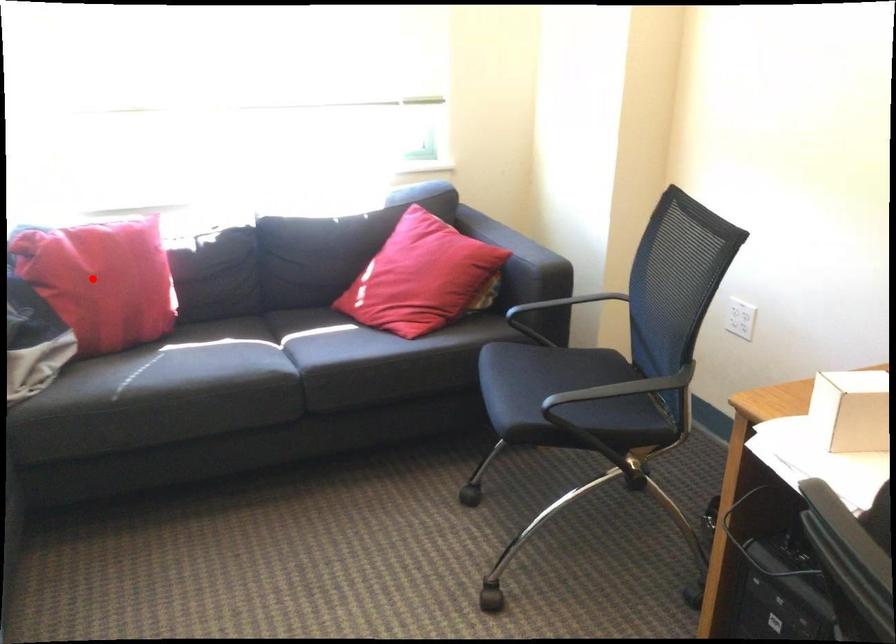
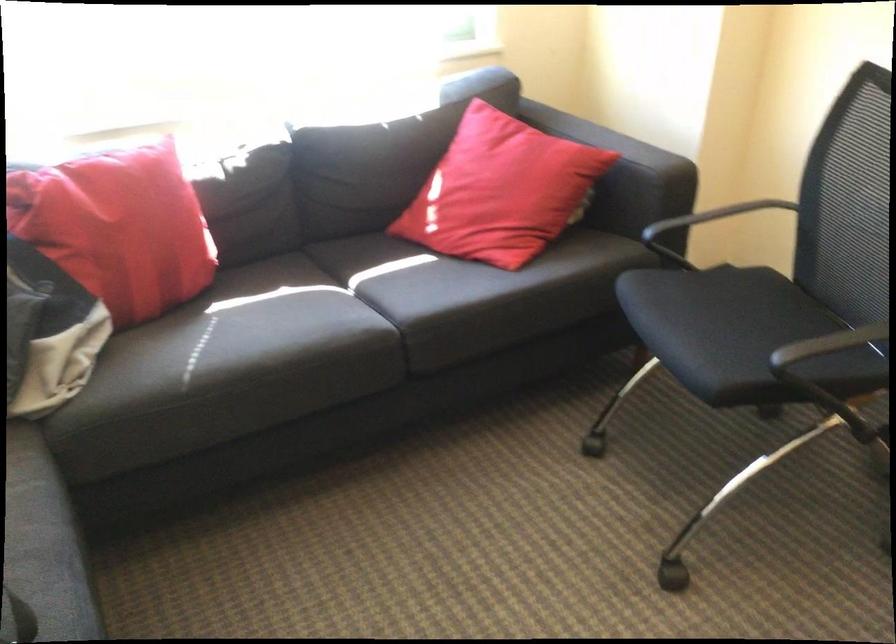
Where in the second image is the point corresponding to the highlighted location from the first image?

(117, 228)